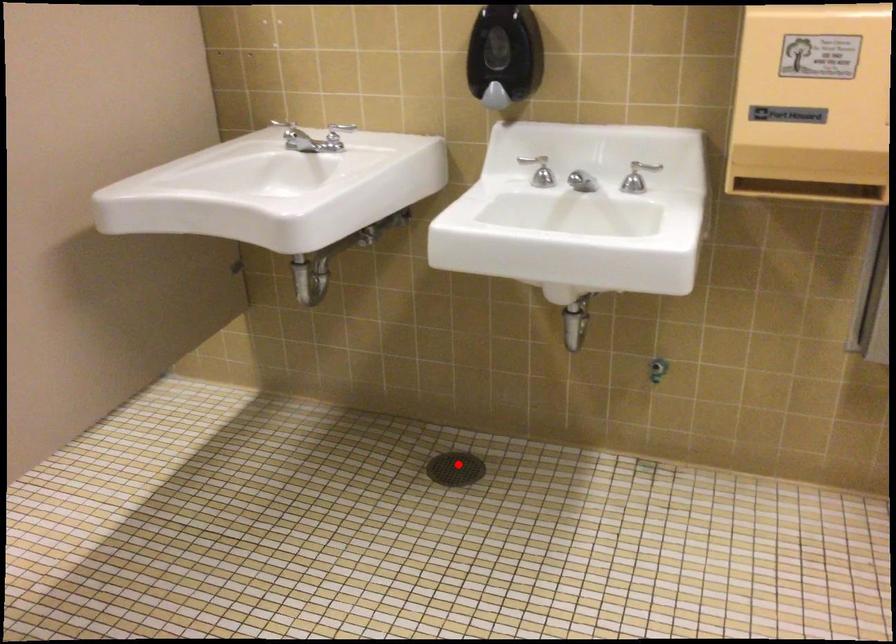
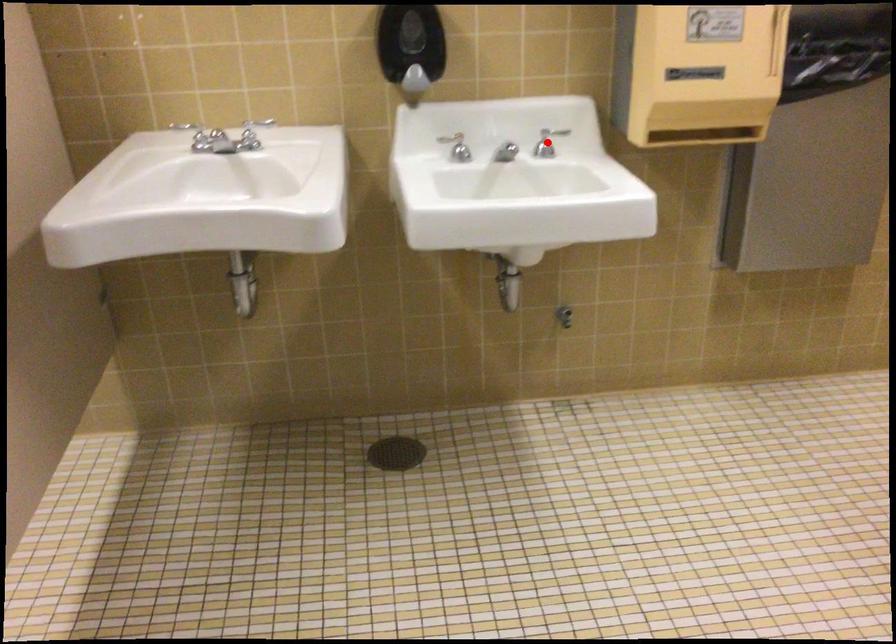
I am providing you with two images of the same scene from different viewpoints. A red point is marked on the first image and another point is marked on the second image. Do the highlighted points in image1 and image2 indicate the same real-world spot?

No